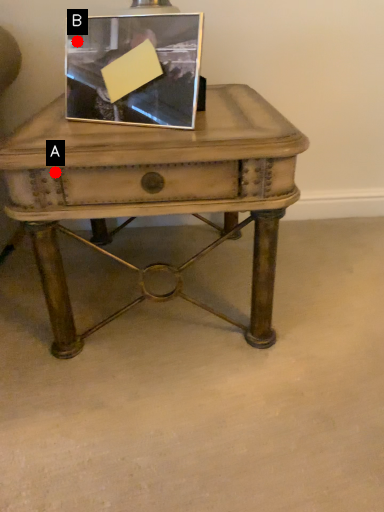
Question: Two points are circled on the image, labeled by A and B beside each circle. Among these points, which one is farthest from the camera?

Choices:
 (A) A is further
 (B) B is further

Answer: (B)